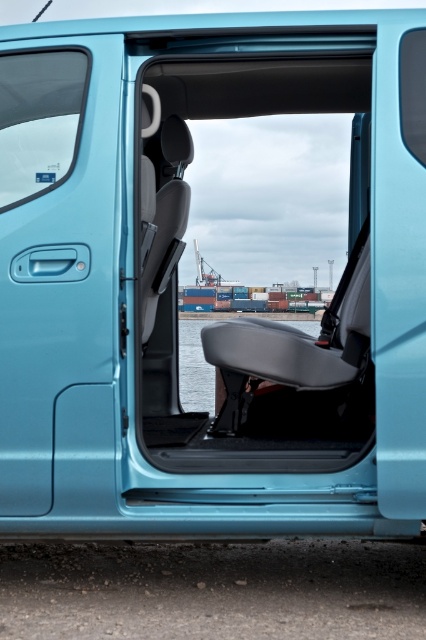
Question: Does light blue metallic door at left appear on the right side of transparent water at seat center?

Choices:
 (A) no
 (B) yes

Answer: (A)

Question: Which of the following is the closest to the observer?

Choices:
 (A) light blue metallic door at left
 (B) transparent water at seat center

Answer: (A)

Question: Which point is farther to the camera?

Choices:
 (A) (189, 371)
 (B) (98, 189)

Answer: (A)

Question: From the image, what is the correct spatial relationship of light blue metallic door at left in relation to transparent water at seat center?

Choices:
 (A) above
 (B) below

Answer: (A)

Question: Which object is farther from the camera taking this photo?

Choices:
 (A) transparent water at seat center
 (B) light blue metallic door at left

Answer: (A)

Question: Can you confirm if light blue metallic door at left is wider than transparent water at seat center?

Choices:
 (A) yes
 (B) no

Answer: (B)